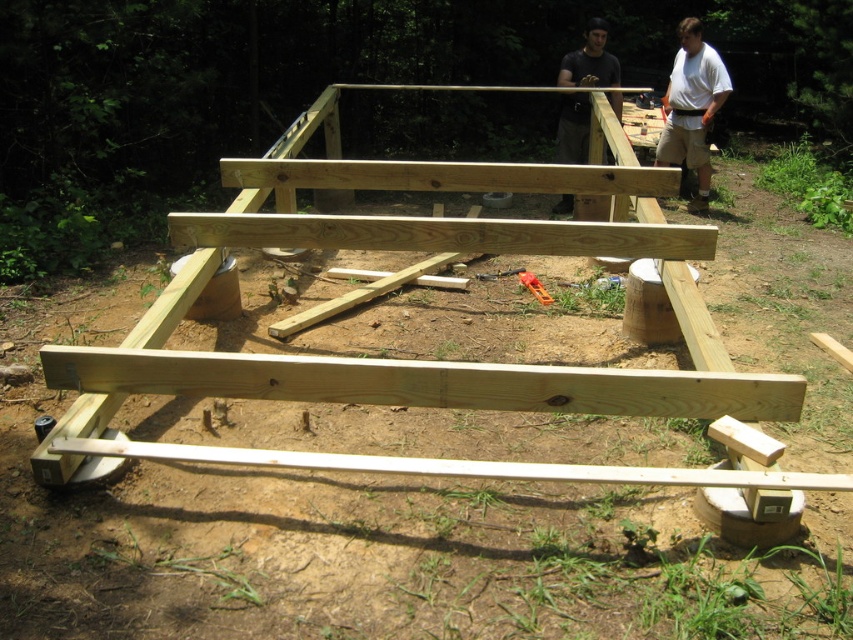
Between point (570, 154) and point (547, 304), which one is positioned in front?

Positioned in front is point (547, 304).

Can you confirm if dark gray shirt at upper center is bigger than metallic orange wrench at center?

Indeed, dark gray shirt at upper center has a larger size compared to metallic orange wrench at center.

Locate an element on the screen. dark gray shirt at upper center is located at coordinates (590, 60).

Is natural wood frame at center below dark gray shirt at upper center?

Indeed, natural wood frame at center is positioned under dark gray shirt at upper center.

Locate an element on the screen. Image resolution: width=853 pixels, height=640 pixels. natural wood frame at center is located at coordinates (430, 360).

This screenshot has height=640, width=853. What are the coordinates of `natural wood frame at center` in the screenshot? It's located at (430, 360).

Is white cotton shirt at upper right smaller than metallic orange wrench at center?

No.

This screenshot has width=853, height=640. What do you see at coordinates (692, 108) in the screenshot?
I see `white cotton shirt at upper right` at bounding box center [692, 108].

Identify the location of white cotton shirt at upper right. (692, 108).